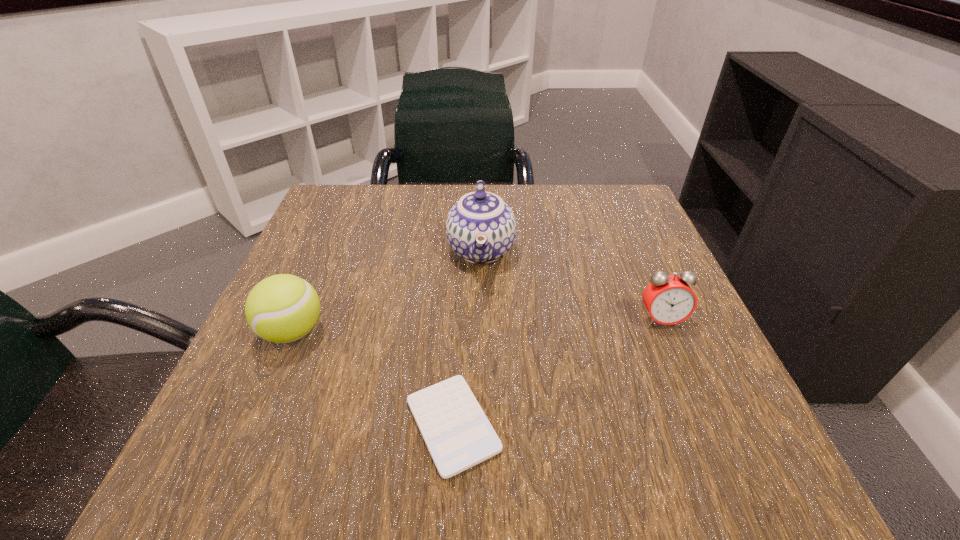
Locate an element on the screen. The height and width of the screenshot is (540, 960). the tallest object is located at coordinates (481, 228).

At what (x,y) coordinates should I click in order to perform the action: click on chinaware. Please return your answer as a coordinate pair (x, y). The width and height of the screenshot is (960, 540). Looking at the image, I should click on (481, 228).

I want to click on the leftmost object, so click(283, 308).

Locate an element on the screen. This screenshot has width=960, height=540. the rightmost object is located at coordinates (669, 299).

Identify the location of the nearest object. This screenshot has width=960, height=540. (458, 435).

Where is `calculator`? This screenshot has width=960, height=540. calculator is located at coordinates (458, 435).

Identify the location of blank space located 0.190m at the spout of the chinaware. (481, 370).

Find the location of a particular element. The height and width of the screenshot is (540, 960). vacant region located 0.120m on the right of the tennis ball is located at coordinates (396, 332).

This screenshot has height=540, width=960. Identify the location of free region located 0.070m on the front-facing side of the rightmost object. (680, 364).

Find the location of a particular element. vacant space situated on the right of the nearest object is located at coordinates pyautogui.click(x=544, y=425).